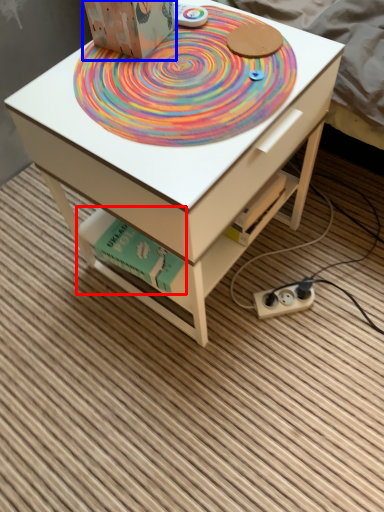
Question: Which object appears farthest to the camera in this image, book (highlighted by a red box) or cardboard box (highlighted by a blue box)?

Choices:
 (A) book
 (B) cardboard box

Answer: (A)